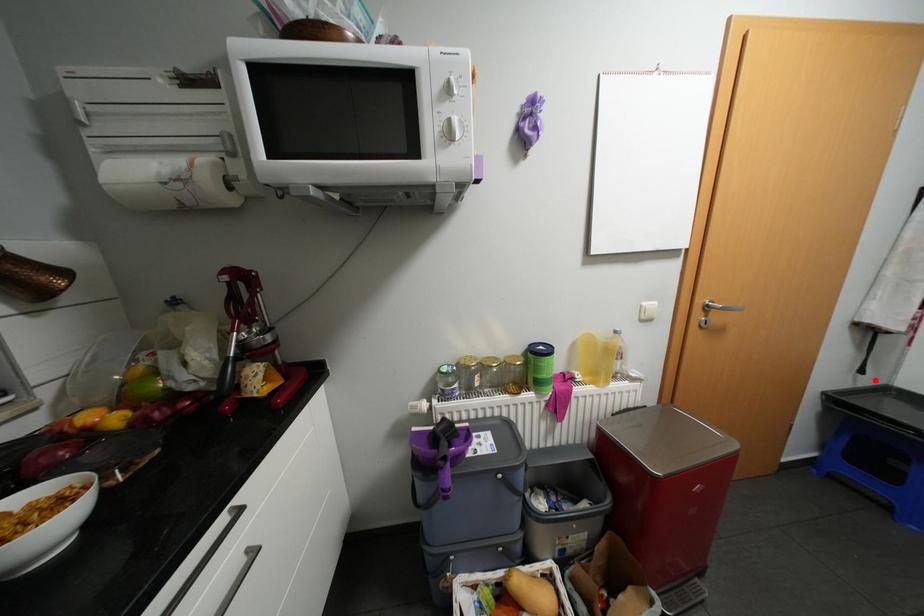
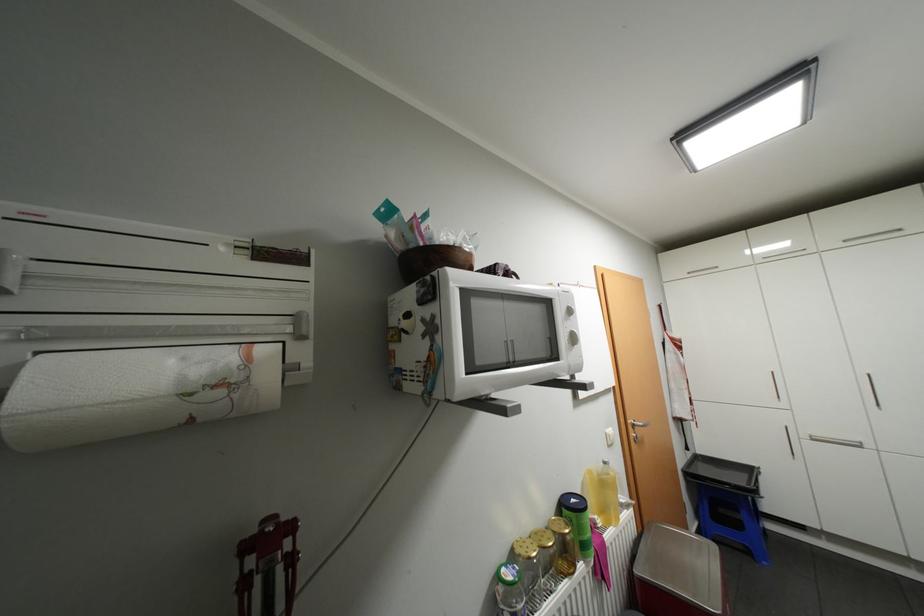
Question: I am providing you with two images of the same scene from different viewpoints. Given a red point in image1, look at the same physical point in image2. Is it:

Choices:
 (A) Closer to the viewpoint
 (B) Farther from the viewpoint

Answer: (B)